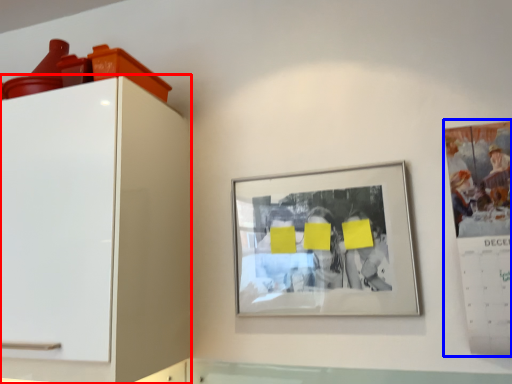
Question: Which object appears farthest to the camera in this image, furniture (highlighted by a red box) or poster (highlighted by a blue box)?

Choices:
 (A) furniture
 (B) poster

Answer: (B)